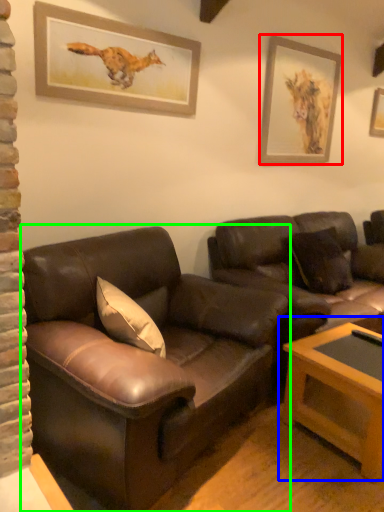
Question: Which object is the farthest from picture frame (highlighted by a red box)? Choose among these: table (highlighted by a blue box) or studio couch (highlighted by a green box).

Choices:
 (A) table
 (B) studio couch

Answer: (B)